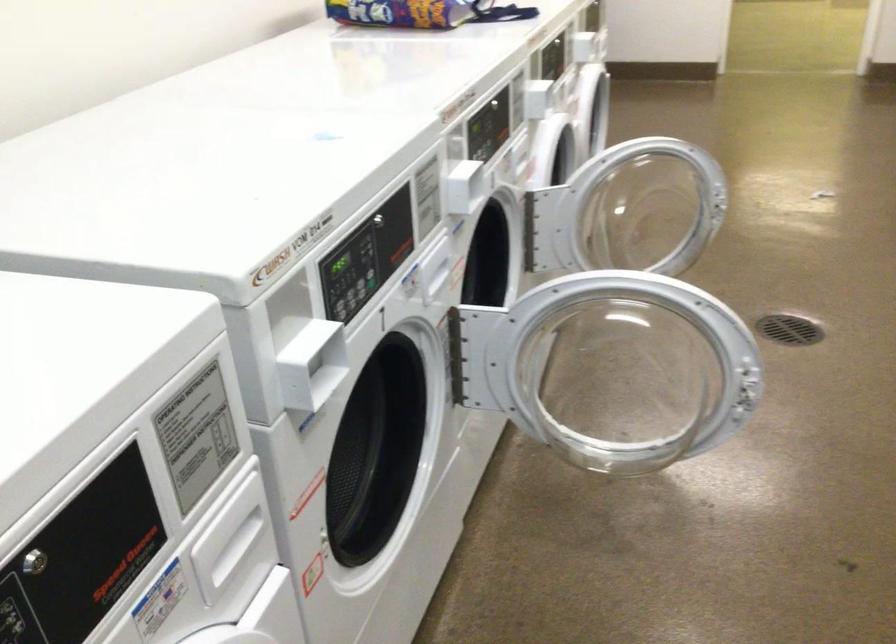
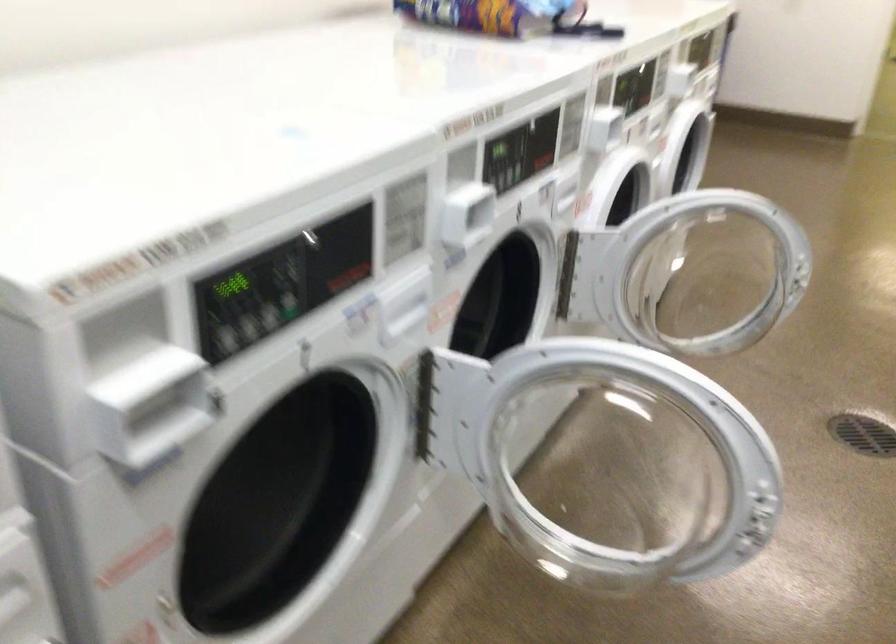
Question: The first image is from the beginning of the video and the second image is from the end. How did the camera likely rotate when shooting the video?

Choices:
 (A) Left
 (B) Right
 (C) Up
 (D) Down

Answer: (A)